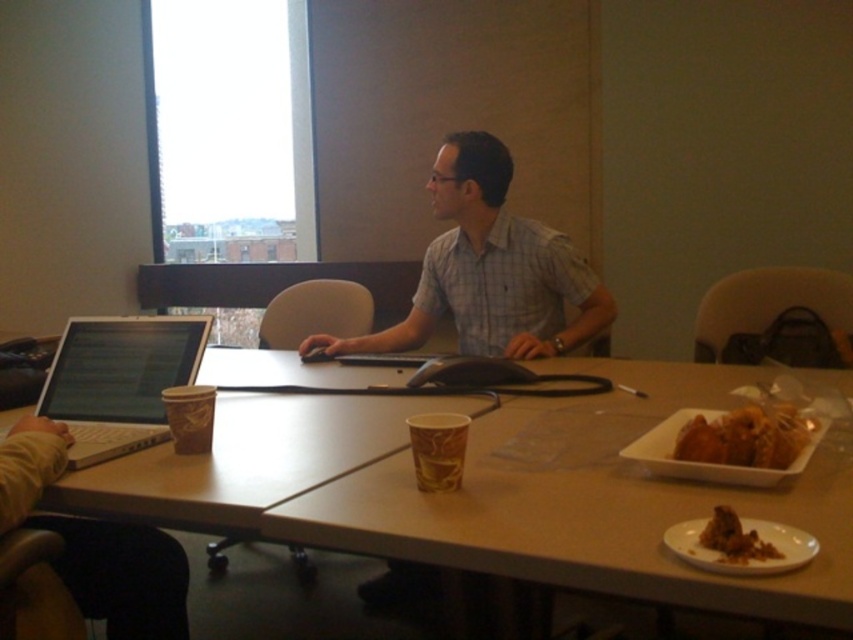
You are a delivery person who needs to place a golden crispy chicken at right on the table in the meeting room. The table has coordinates from 0 to 1 in width and height. Where should you place it?

The golden crispy chicken at right should be placed at the coordinates point [746,436] on the table.

You are planning to place a rectangular object that is 1.5 meters long on the wooden table at center. Considering the golden crispy chicken at right is already on the table, will the object fit horizontally on the table?

The wooden table at center is wider than the golden crispy chicken at right. Since the chicken is on the table, the table must be at least wider than the chicken. However, the chicken width is unknown. The question states the object is 1.5 meters long. Without knowing the table width, we cannot confirm if it fits. The given information only states the table is wider than the chicken, but not by how much. Thus, it is uncertain if the 1.5m object will fit.

You are a waiter in a restaurant and see the wooden table at center and the golden crispy chicken at right. Which object is located to the right of the other?

The golden crispy chicken at right is located to the right of the wooden table at center.